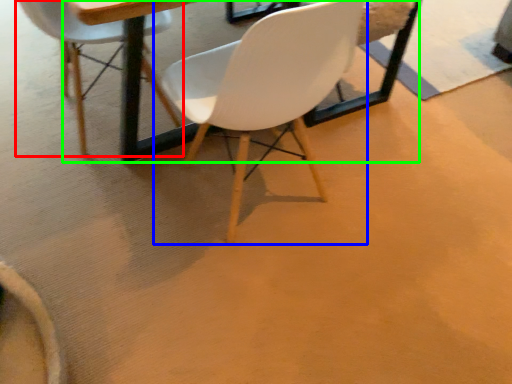
Question: Which object is positioned farthest from chair (highlighted by a red box)? Select from chair (highlighted by a blue box) and round table (highlighted by a green box).

Choices:
 (A) chair
 (B) round table

Answer: (A)